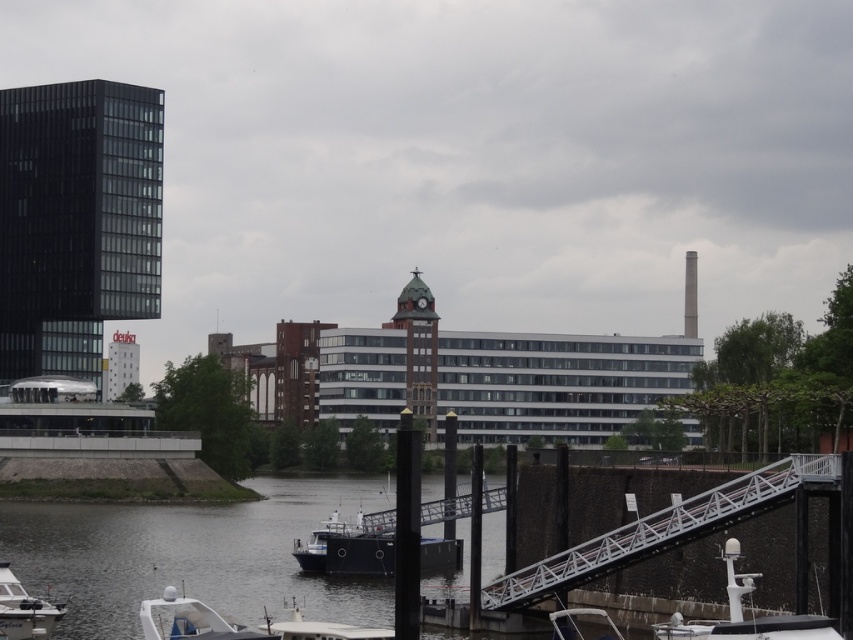
You are a delivery drone that needs to fly from the black glass building at left to the dark blue water at center. What is the minimum horizontal distance you must cover to reach the water from the building?

The minimum horizontal distance between the black glass building at left and the dark blue water at center is 31.31 meters, so the drone must cover at least 31.31 meters to reach the water from the building.

From the picture: You are a delivery person who needs to place a package between the white matte boat at lower left and the white plastic boat at lower center. The package requires a space of 2 meters. Is there enough space between them?

The white matte boat at lower left and white plastic boat at lower center are 2.19 meters apart from each other, so yes, there is enough space to place the package between them since the distance is greater than 2 meters.

You are a delivery drone that needs to fly from the black glass building at left to the white matte boat at lower left. The minimum distance required for your drone to safely navigate between obstacles is 100 meters. Can you safely make this delivery route without any issues?

The black glass building at left and white matte boat at lower left are 101.61 meters apart from each other. Since the required minimum distance is 100 meters, the drone can safely navigate the route as the distance exceeds the safety requirement.